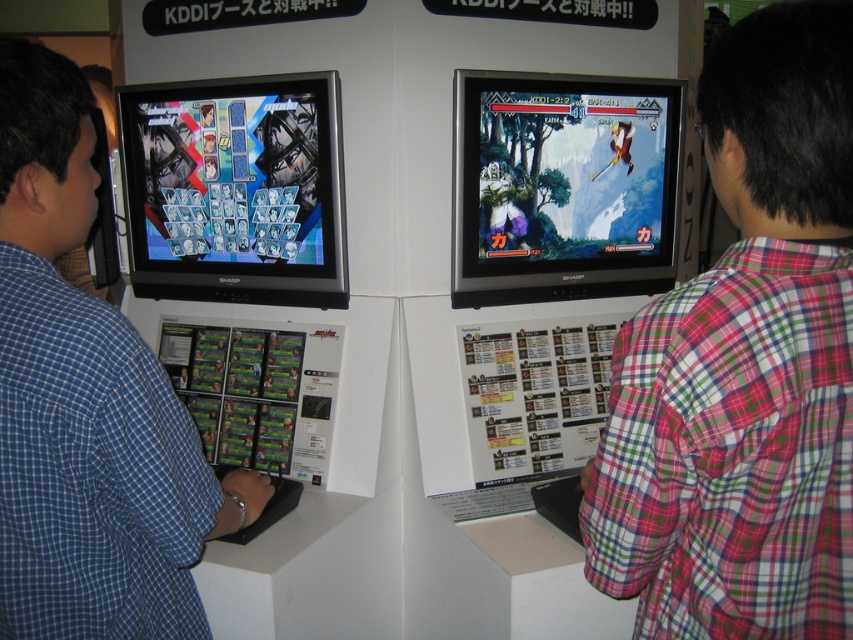
Can you confirm if plaid shirt at right is positioned below blue plaid shirt at left?

Incorrect, plaid shirt at right is not positioned below blue plaid shirt at left.

Is plaid shirt at right further to the viewer compared to blue plaid shirt at left?

No, plaid shirt at right is closer to the viewer.

Which is behind, point (827, 80) or point (112, 371)?

Positioned behind is point (112, 371).

This screenshot has width=853, height=640. What are the coordinates of `plaid shirt at right` in the screenshot? It's located at pyautogui.click(x=746, y=365).